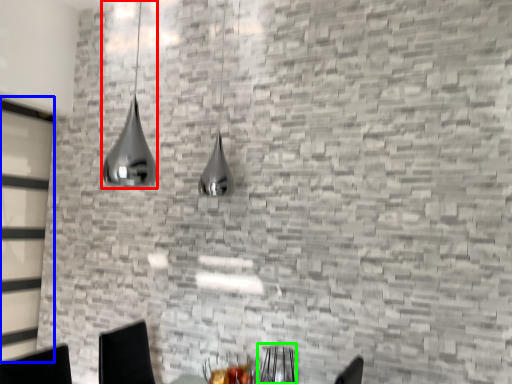
Question: Which object is the closest to the lamp (highlighted by a red box)? Choose among these: glass door (highlighted by a blue box) or armchair (highlighted by a green box).

Choices:
 (A) glass door
 (B) armchair

Answer: (A)